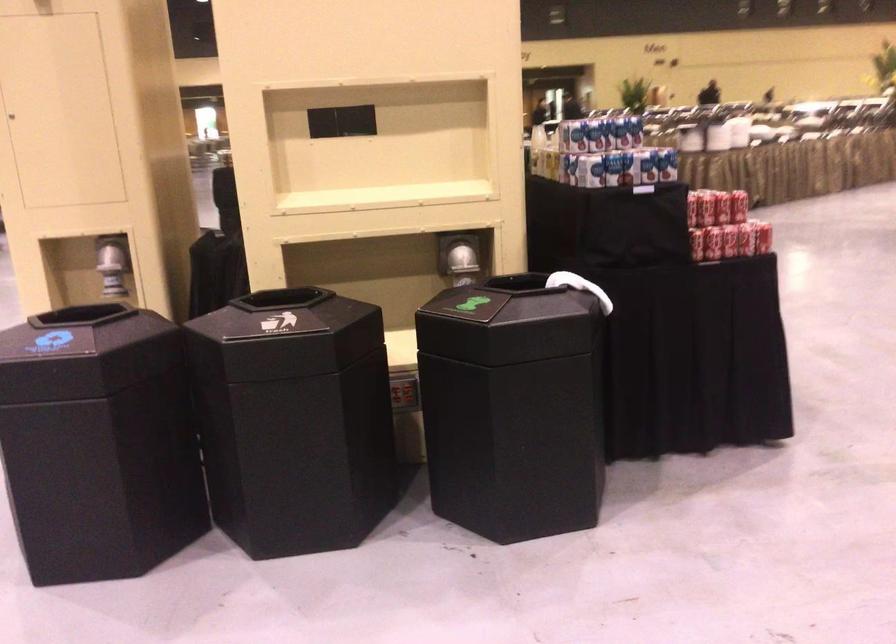
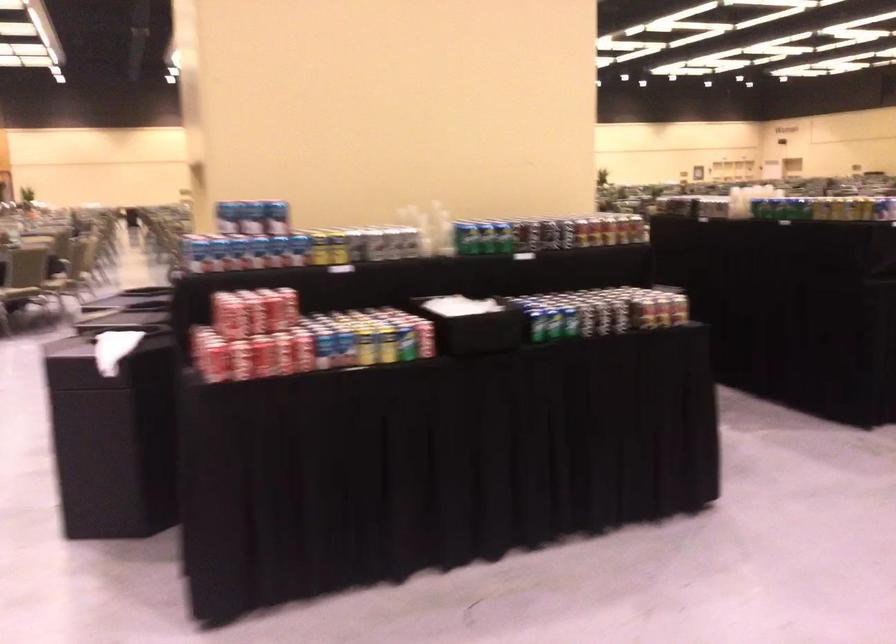
In the second image, find the point that corresponds to point (639, 134) in the first image.

(277, 218)